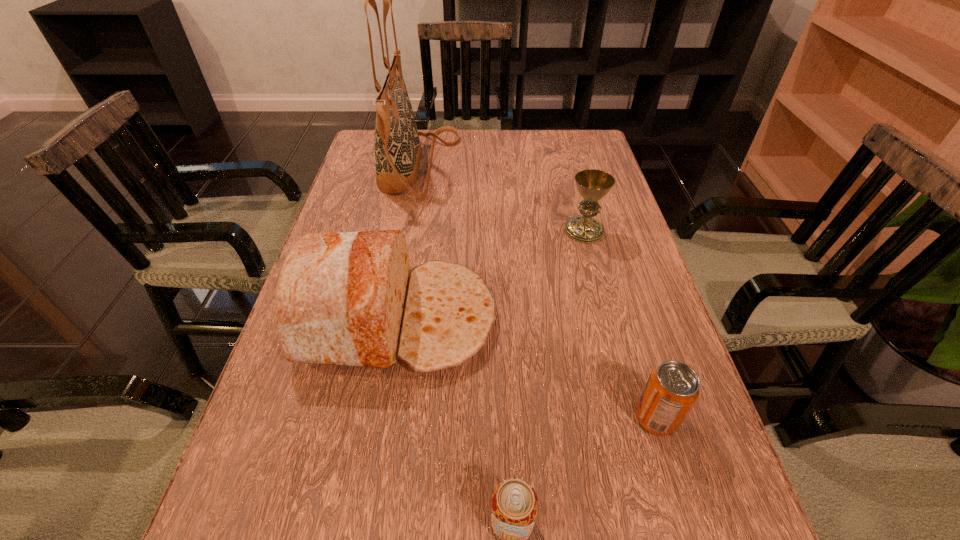
Locate an element on the screen. The width and height of the screenshot is (960, 540). the tallest object is located at coordinates (398, 151).

Where is `the farthest object`? Image resolution: width=960 pixels, height=540 pixels. the farthest object is located at coordinates (398, 151).

Locate an element on the screen. The width and height of the screenshot is (960, 540). bread is located at coordinates (348, 298).

You are a GUI agent. You are given a task and a screenshot of the screen. Output one action in this format:
    pyautogui.click(x=<x>, y=<y>)
    Task: Click on the fourth shortest object
    
    Given the screenshot: What is the action you would take?
    (x=348, y=298)

At what (x,y) coordinates should I click in order to perform the action: click on the third tallest object. Please return your answer as a coordinate pair (x, y). The height and width of the screenshot is (540, 960). Looking at the image, I should click on (593, 185).

At what (x,y) coordinates should I click in order to perform the action: click on chalice. Please return your answer as a coordinate pair (x, y). This screenshot has height=540, width=960. Looking at the image, I should click on click(x=593, y=185).

Where is `the second shortest object`? The height and width of the screenshot is (540, 960). the second shortest object is located at coordinates coord(672,389).

Where is `the second nearest object`? Image resolution: width=960 pixels, height=540 pixels. the second nearest object is located at coordinates (672, 389).

In order to click on free point located on the front-facing side of the handbag in this screenshot , I will do `click(486, 167)`.

This screenshot has height=540, width=960. Find the location of `vacant region located at the sliced end of the third nearest object`. vacant region located at the sliced end of the third nearest object is located at coordinates (540, 319).